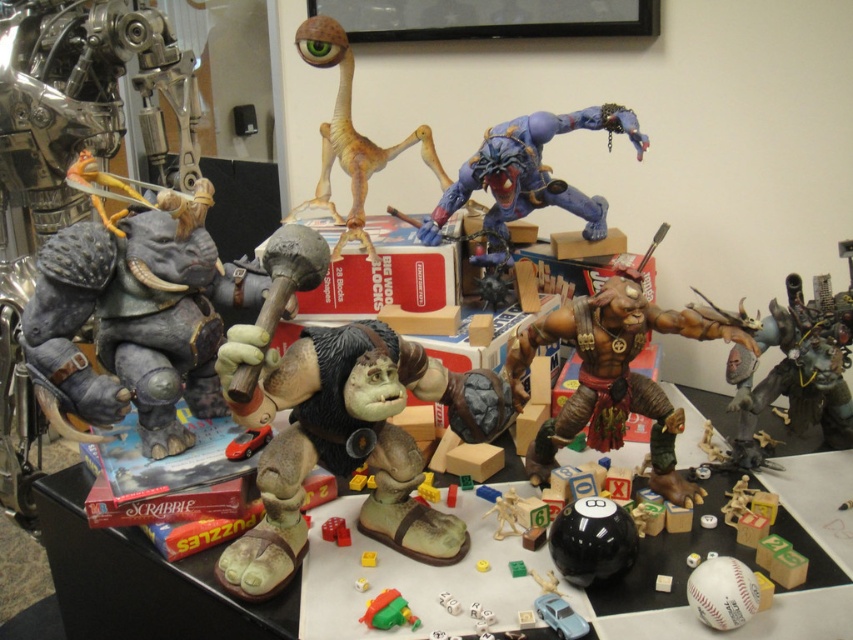
You are organizing a toy display and need to place the green matte gorilla at center and the brown matte alien at center on a shelf. Which toy requires a wider space to fit properly?

The green matte gorilla at center requires a wider space because its width is larger than the brown matte alien at center.

You are organizing a miniature collection on a table. You have a green matte gorilla at center and a brown matte alien at center. Which object is positioned lower on the table?

The green matte gorilla at center is located below the brown matte alien at center, so it is positioned lower on the table.